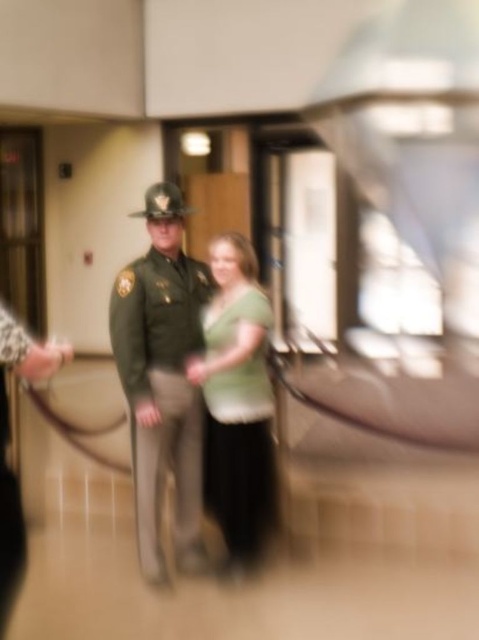
Identify the location of green matte shirt at center. This screenshot has height=640, width=479. (239, 401).

Which is in front, point (260, 321) or point (10, 477)?

Point (10, 477) is in front.

Locate an element on the screen. The image size is (479, 640). green matte shirt at center is located at coordinates (239, 401).

Is green uniform at center taller than green matte shirt at center?

Yes, green uniform at center is taller than green matte shirt at center.

Where is `green uniform at center`? The image size is (479, 640). green uniform at center is located at coordinates (162, 380).

Where is `green uniform at center`? The height and width of the screenshot is (640, 479). green uniform at center is located at coordinates (162, 380).

Which is more to the right, green uniform at center or green matte uniform at left?

green uniform at center is more to the right.

Is green uniform at center shorter than green matte uniform at left?

In fact, green uniform at center may be taller than green matte uniform at left.

This screenshot has height=640, width=479. What are the coordinates of `green uniform at center` in the screenshot? It's located at (162, 380).